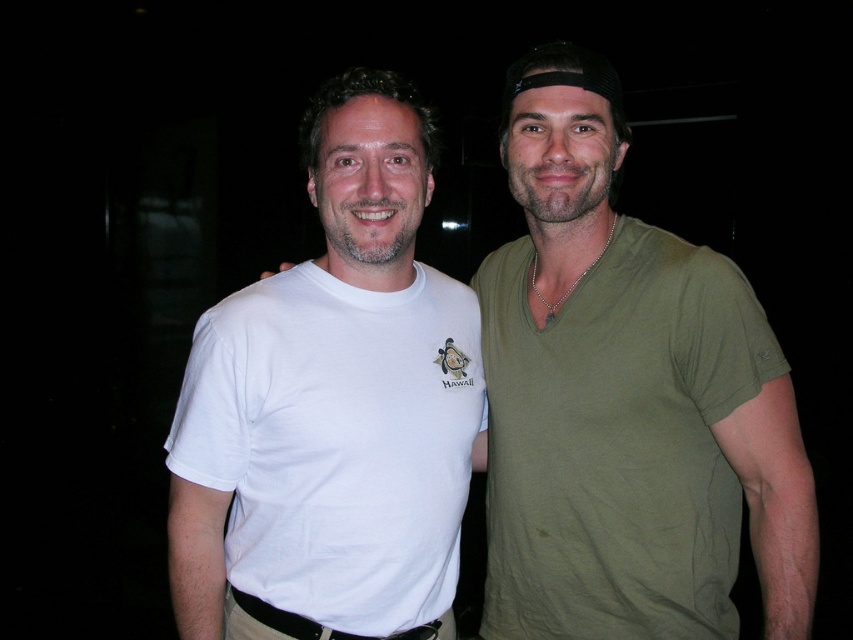
Is white cotton t-shirt at center closer to the viewer compared to white cotton t-shirt at left?

Yes.

Can you confirm if white cotton t-shirt at center is shorter than white cotton t-shirt at left?

No.

Describe the element at coordinates (625, 400) in the screenshot. This screenshot has width=853, height=640. I see `white cotton t-shirt at center` at that location.

Locate an element on the screen. This screenshot has height=640, width=853. white cotton t-shirt at center is located at coordinates (625, 400).